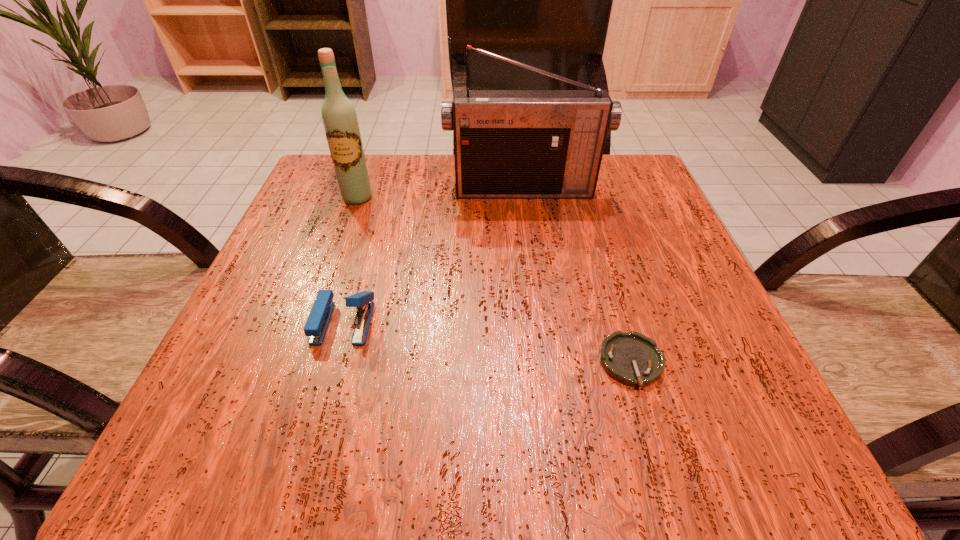
Find the location of a particular element. free space that satisfies the following two spatial constraints: 1. on the front-facing side of the ashtray; 2. on the left side of the wine bottle is located at coordinates (300, 362).

Where is `free space that satisfies the following two spatial constraints: 1. on the front-facing side of the radio receiver; 2. on the left side of the ashtray`? free space that satisfies the following two spatial constraints: 1. on the front-facing side of the radio receiver; 2. on the left side of the ashtray is located at coordinates (546, 362).